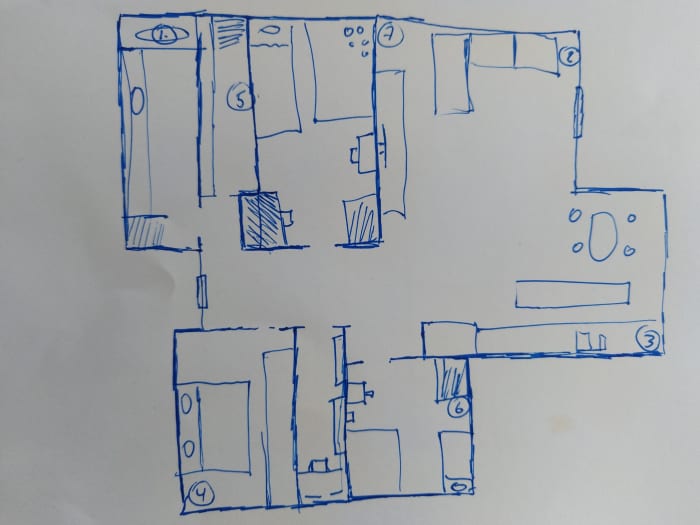
You are a GUI agent. You are given a task and a screenshot of the screen. Output one action in this format:
    pyautogui.click(x=<x>, y=<y>)
    Task: Click on the center of living room tv
    This screenshot has width=700, height=525.
    Given the screenshot: What is the action you would take?
    pyautogui.click(x=383, y=146)